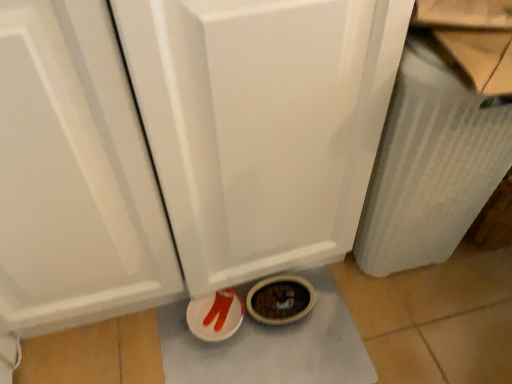
This screenshot has height=384, width=512. I want to click on vacant space in front of matte plastic shoes at lower center, so click(x=221, y=367).